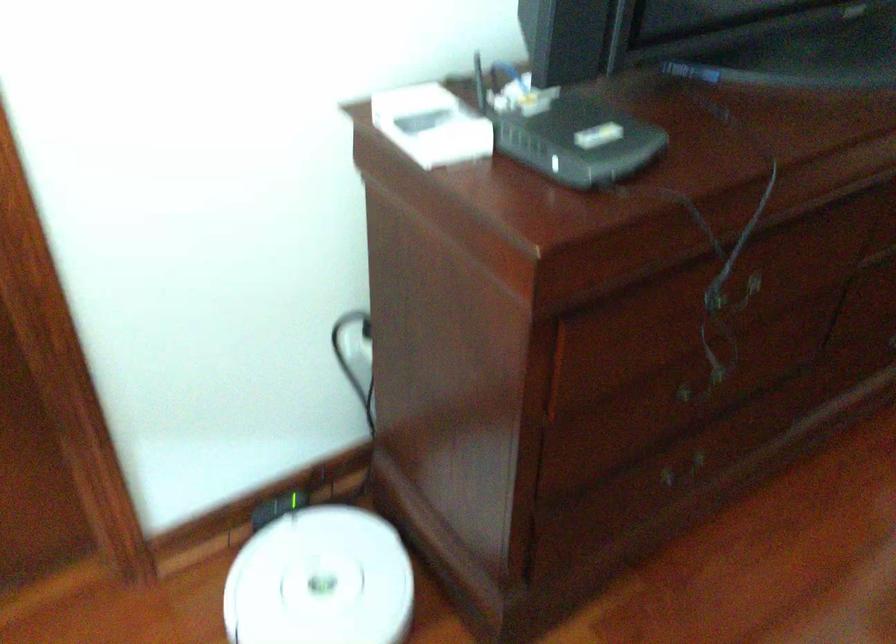
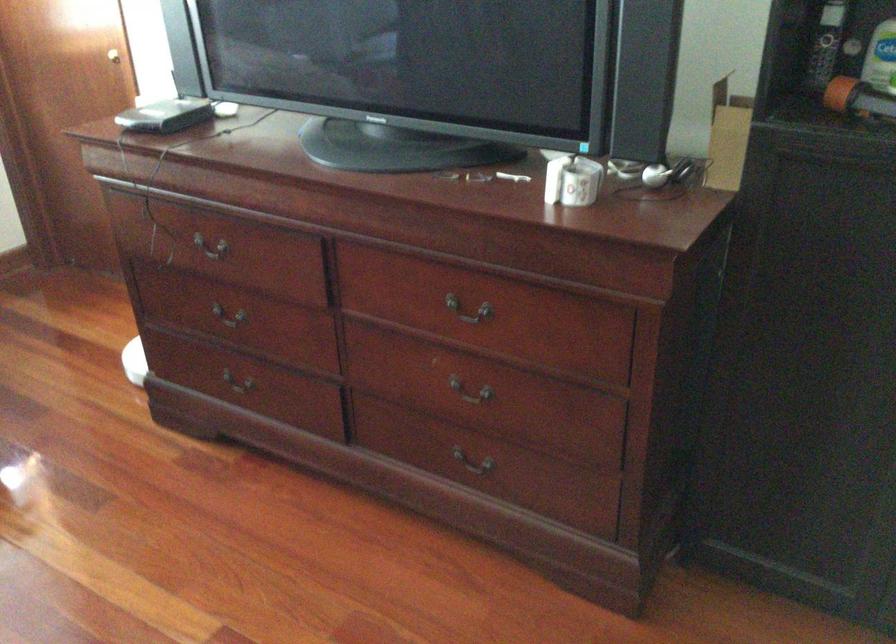
Question: I am providing you with two images of the same scene from different viewpoints. Please identify which objects are invisible in image2.

Choices:
 (A) square wall button
 (B) white robot vacuum
 (C) brass doorknob
 (D) green top bottle

Answer: (B)